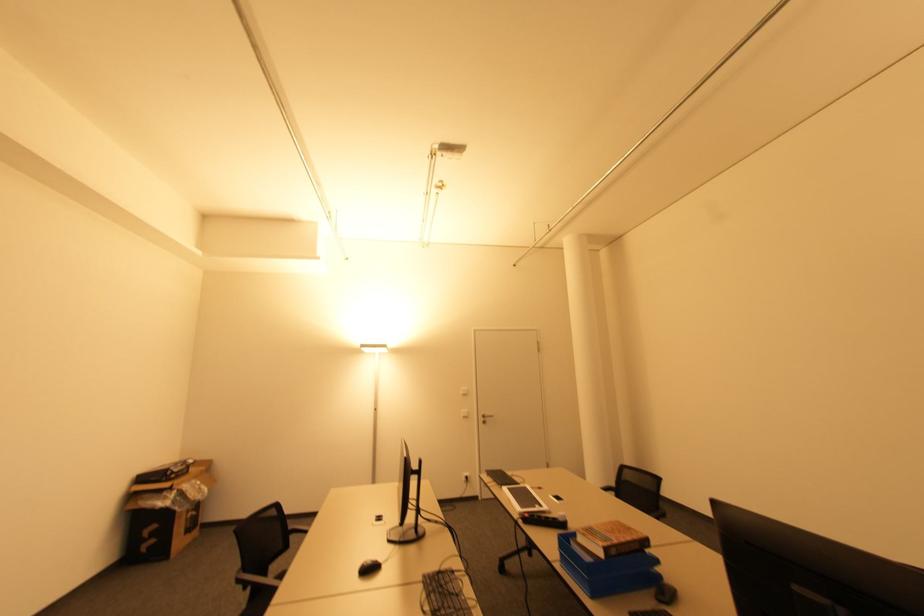
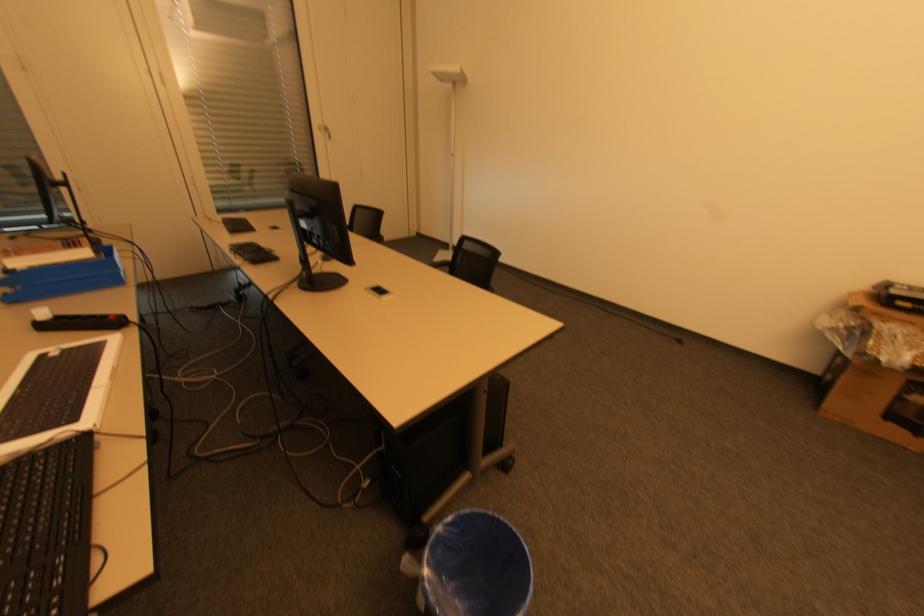
Find the pixel in the second image that matches (176,496) in the first image.

(850, 328)